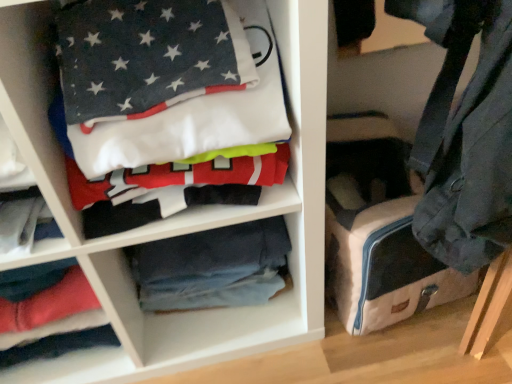
Identify the location of vacant space underneath blue denim jeans at center (from a real-world perspective). (226, 310).